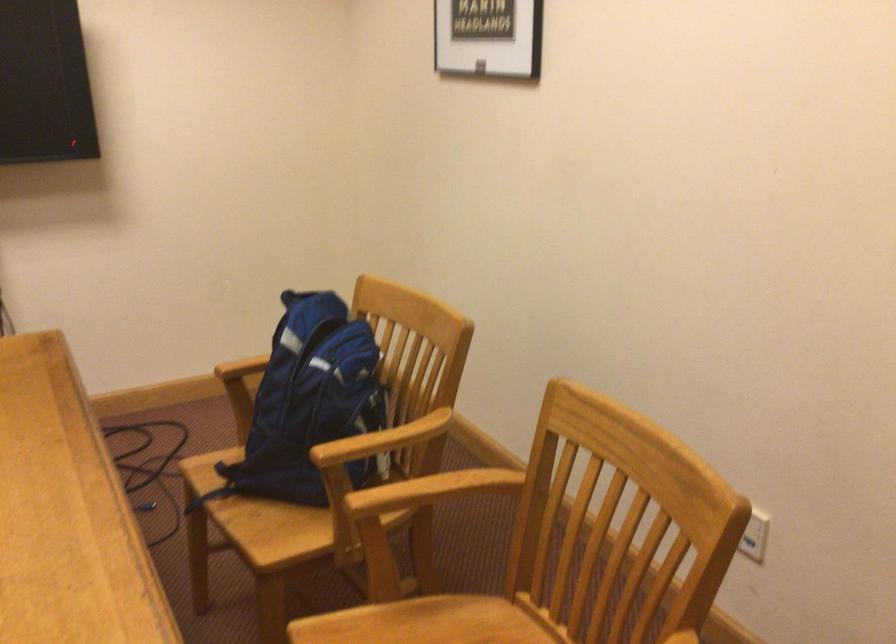
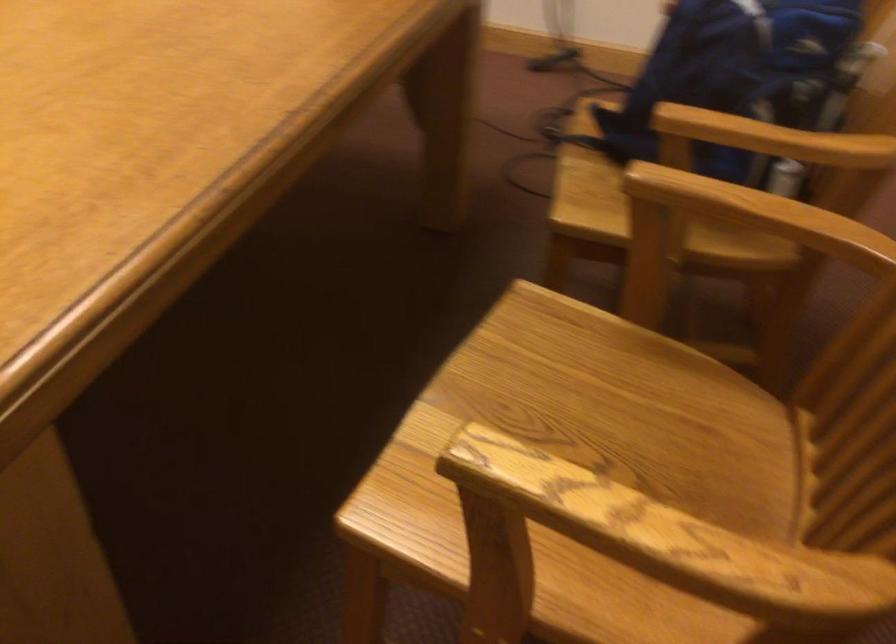
Where in the second image is the point corresponding to point (254, 529) from the first image?

(584, 187)